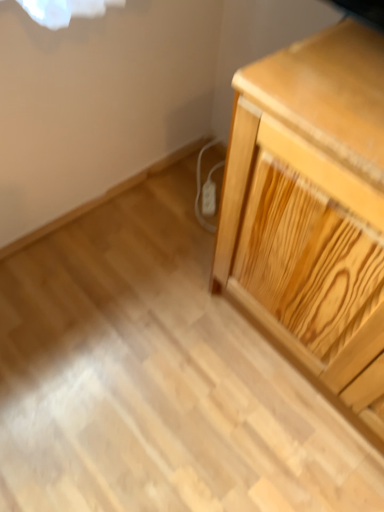
Question: Is point (342, 382) closer or farther from the camera than point (210, 202)?

Choices:
 (A) closer
 (B) farther

Answer: (A)

Question: Considering their positions, is light wood chest of drawers at right located in front of or behind white plastic electric outlet at lower center?

Choices:
 (A) front
 (B) behind

Answer: (A)

Question: From a real-world perspective, is light wood chest of drawers at right physically located above or below white plastic electric outlet at lower center?

Choices:
 (A) below
 (B) above

Answer: (B)

Question: From a real-world perspective, is white plastic electric outlet at lower center positioned above or below light wood chest of drawers at right?

Choices:
 (A) above
 (B) below

Answer: (B)

Question: Is white plastic electric outlet at lower center situated inside light wood chest of drawers at right or outside?

Choices:
 (A) inside
 (B) outside

Answer: (B)

Question: In the image, is white plastic electric outlet at lower center on the left side or the right side of light wood chest of drawers at right?

Choices:
 (A) left
 (B) right

Answer: (A)

Question: Does point (203, 202) appear closer or farther from the camera than point (375, 368)?

Choices:
 (A) closer
 (B) farther

Answer: (B)